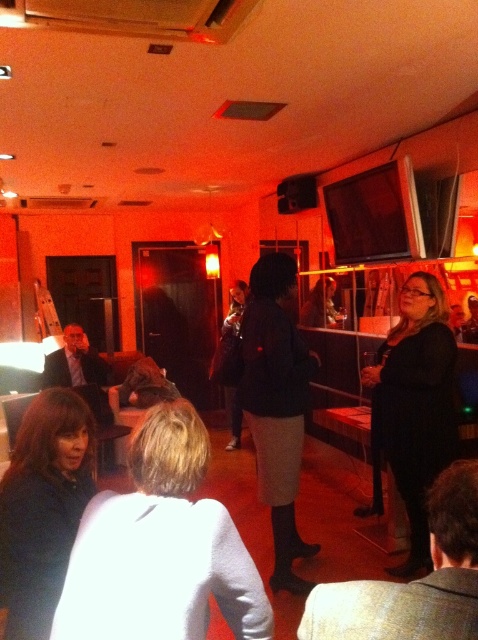
You are at a social event and want to find someone wearing a matte black jacket at lower left and dark gray skirt at center. Which one is shorter in height?

The matte black jacket at lower left has a lesser height compared to dark gray skirt at center, so the matte black jacket at lower left is shorter.